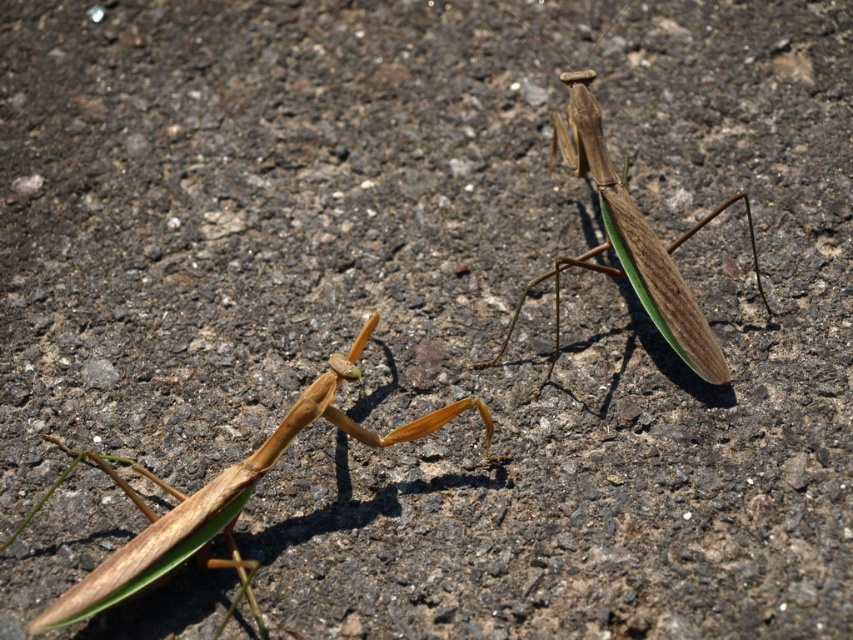
Question: Which point is closer to the camera?

Choices:
 (A) (508, 339)
 (B) (215, 564)

Answer: (B)

Question: Can you confirm if brown matte praying mantis at lower left is positioned to the left of brown matte/greenish wings at center?

Choices:
 (A) no
 (B) yes

Answer: (B)

Question: Is brown matte praying mantis at lower left closer to camera compared to brown matte/greenish wings at center?

Choices:
 (A) no
 (B) yes

Answer: (B)

Question: Does brown matte praying mantis at lower left have a smaller size compared to brown matte/greenish wings at center?

Choices:
 (A) no
 (B) yes

Answer: (B)

Question: Which point is closer to the camera taking this photo?

Choices:
 (A) (608, 189)
 (B) (300, 403)

Answer: (B)